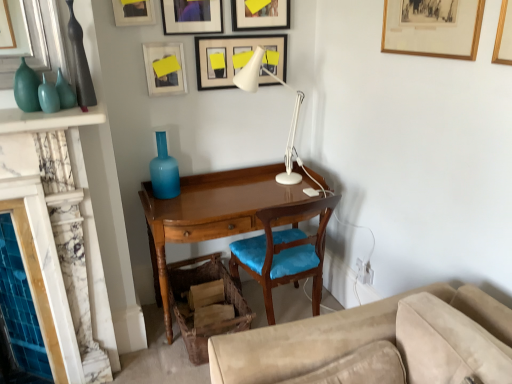
Locate an element on the screen. free point to the right of matte blue glass vase at center, which is the third glass vase in left-to-right order is located at coordinates (207, 193).